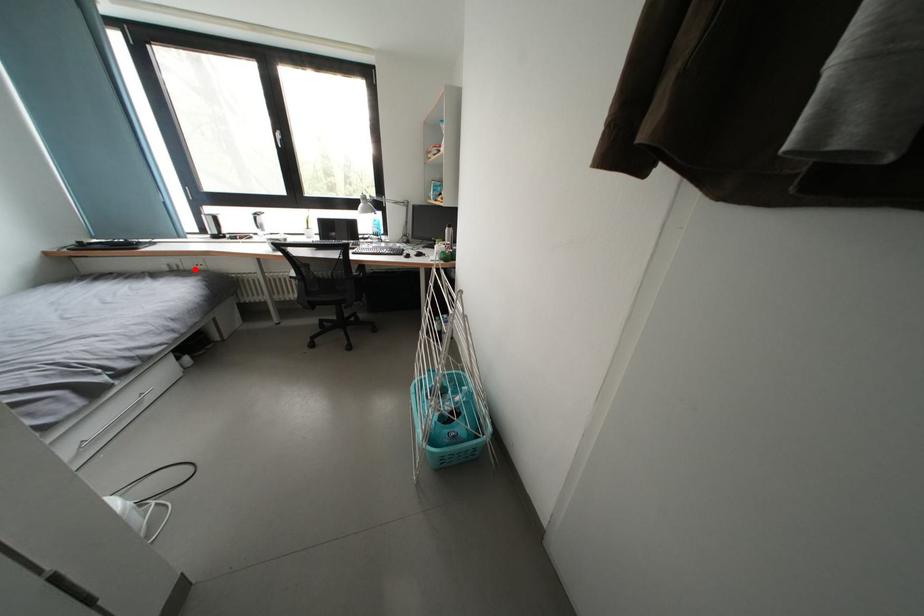
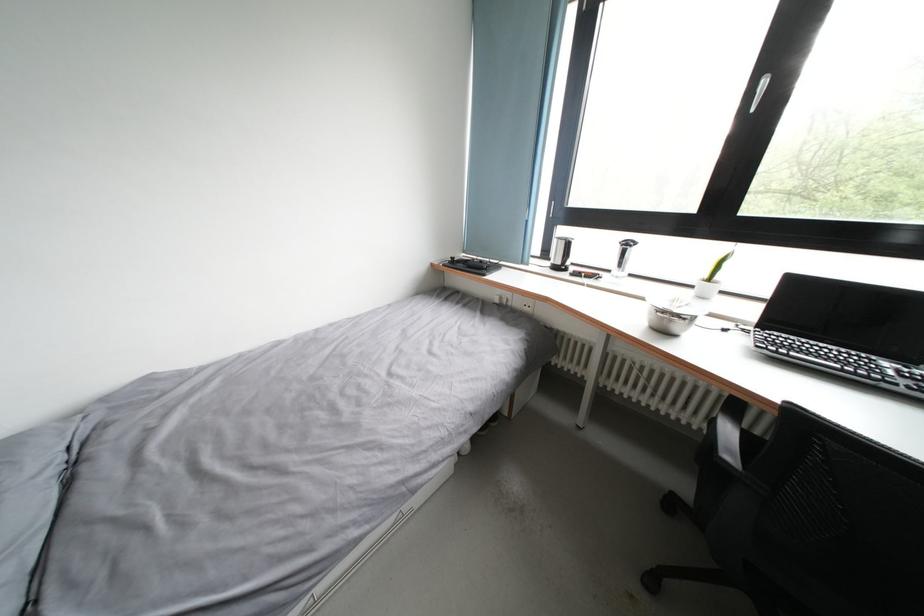
Where in the second image is the point corresponding to the highlighted location from the first image?

(524, 308)